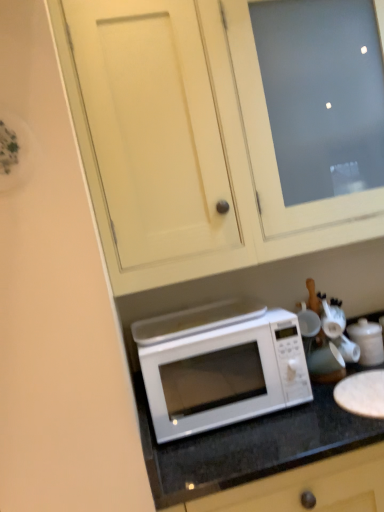
Question: Does white matte cabinet at upper center have a lesser height compared to white glossy microwave at center?

Choices:
 (A) yes
 (B) no

Answer: (B)

Question: Is white matte cabinet at upper center at the right side of white glossy microwave at center?

Choices:
 (A) yes
 (B) no

Answer: (A)

Question: Is white matte cabinet at upper center thinner than white glossy microwave at center?

Choices:
 (A) no
 (B) yes

Answer: (A)

Question: From the image's perspective, is white matte cabinet at upper center located beneath white glossy microwave at center?

Choices:
 (A) no
 (B) yes

Answer: (A)

Question: From the image's perspective, is white matte cabinet at upper center on top of white glossy microwave at center?

Choices:
 (A) no
 (B) yes

Answer: (B)

Question: Can you confirm if white matte cabinet at upper center is bigger than white glossy microwave at center?

Choices:
 (A) no
 (B) yes

Answer: (B)

Question: Does white matte cabinet at upper center have a lesser width compared to white glossy microwave at lower center?

Choices:
 (A) yes
 (B) no

Answer: (A)

Question: Does white matte cabinet at upper center contain white glossy microwave at lower center?

Choices:
 (A) yes
 (B) no

Answer: (B)

Question: Is white glossy microwave at lower center at the back of white matte cabinet at upper center?

Choices:
 (A) no
 (B) yes

Answer: (A)

Question: Can you confirm if white matte cabinet at upper center is positioned to the right of white glossy microwave at lower center?

Choices:
 (A) yes
 (B) no

Answer: (B)

Question: Considering the relative sizes of white matte cabinet at upper center and white glossy microwave at lower center in the image provided, is white matte cabinet at upper center taller than white glossy microwave at lower center?

Choices:
 (A) yes
 (B) no

Answer: (A)

Question: Considering the relative positions of white matte cabinet at upper center and white glossy microwave at lower center in the image provided, is white matte cabinet at upper center to the left of white glossy microwave at lower center from the viewer's perspective?

Choices:
 (A) yes
 (B) no

Answer: (A)

Question: Is white glossy teapot at right at the right side of white glossy microwave at lower center?

Choices:
 (A) yes
 (B) no

Answer: (A)